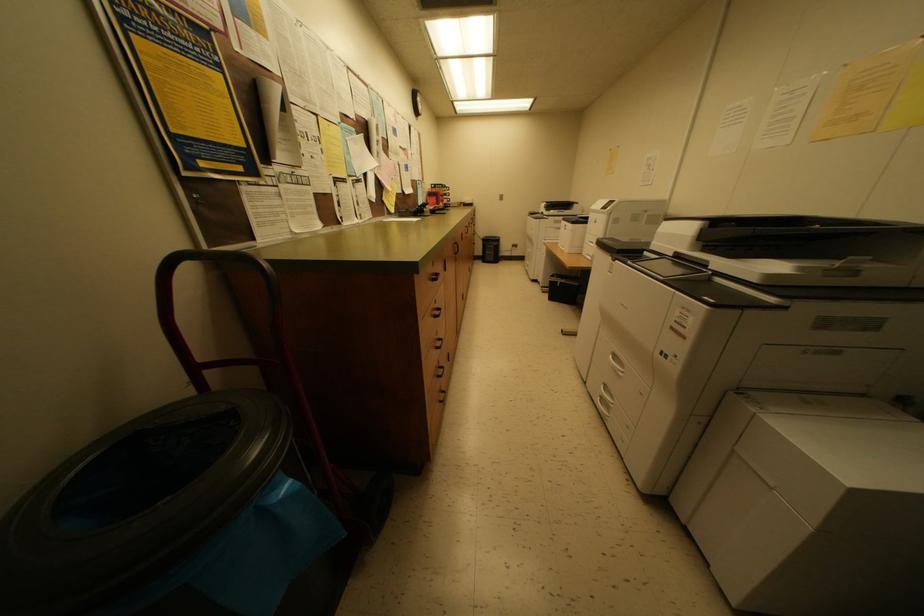
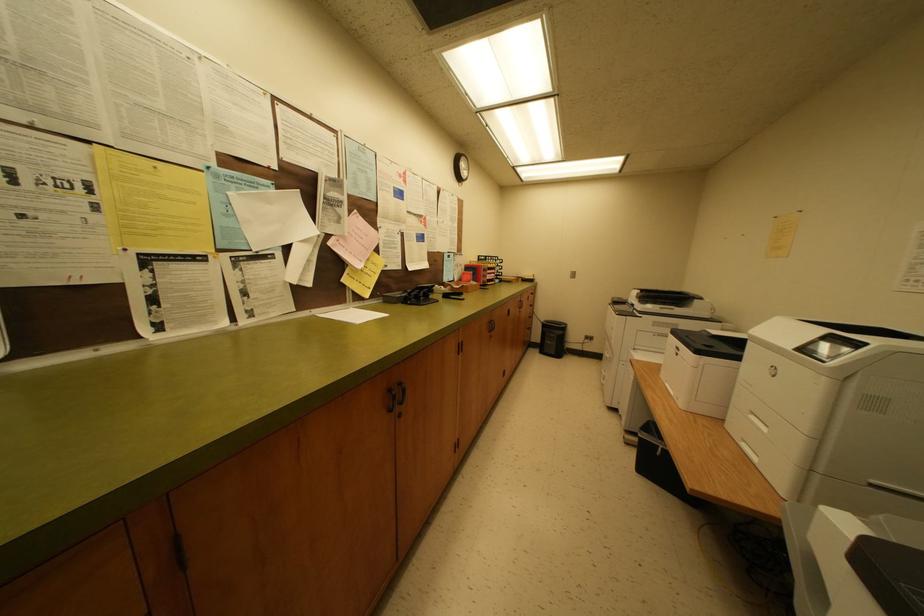
The images are taken continuously from a first-person perspective. In which direction are you moving?

The movement direction of the cameraman is right, forward.